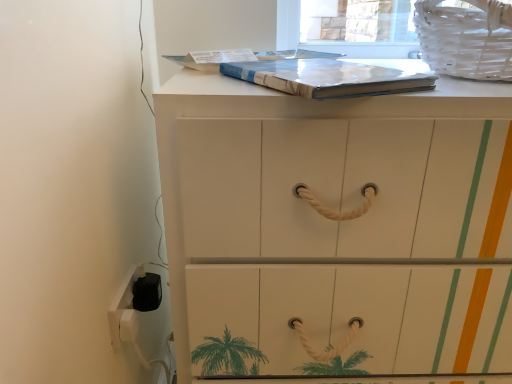
What do you see at coordinates (121, 305) in the screenshot? I see `white plastic electric outlet at lower left` at bounding box center [121, 305].

Where is `white wicker laundry basket at upper right`? This screenshot has height=384, width=512. white wicker laundry basket at upper right is located at coordinates (466, 38).

You are a GUI agent. You are given a task and a screenshot of the screen. Output one action in this format:
    pyautogui.click(x=<x>, y=<y>)
    Task: Click on the white plastic electric outlet at lower left
    Image resolution: width=512 pixels, height=384 pixels.
    Given the screenshot: What is the action you would take?
    pyautogui.click(x=121, y=305)

Can you confirm if matte blue paperback book at upper center is bigger than white plastic electric outlet at lower left?

Yes, matte blue paperback book at upper center is bigger than white plastic electric outlet at lower left.

Considering the relative positions of matte blue paperback book at upper center and white plastic electric outlet at lower left in the image provided, is matte blue paperback book at upper center to the left or to the right of white plastic electric outlet at lower left?

In the image, matte blue paperback book at upper center appears on the right side of white plastic electric outlet at lower left.

Is matte blue paperback book at upper center looking in the opposite direction of white plastic electric outlet at lower left?

matte blue paperback book at upper center is not turned away from white plastic electric outlet at lower left.

Identify the location of paperback book located above the white plastic electric outlet at lower left (from the image's perspective). The width and height of the screenshot is (512, 384). (327, 78).

Measure the distance from white painted wood chest of drawers at center to matte blue paperback book at upper center.

white painted wood chest of drawers at center is 8.57 inches away from matte blue paperback book at upper center.

Which object is positioned more to the left, white painted wood chest of drawers at center or matte blue paperback book at upper center?

From the viewer's perspective, matte blue paperback book at upper center appears more on the left side.

In the scene shown: Is white painted wood chest of drawers at center far away from matte blue paperback book at upper center?

No, white painted wood chest of drawers at center is in close proximity to matte blue paperback book at upper center.

The image size is (512, 384). Find the location of `paperback book above the white painted wood chest of drawers at center (from the image's perspective)`. paperback book above the white painted wood chest of drawers at center (from the image's perspective) is located at coordinates (327, 78).

Considering the relative positions of white plastic electric outlet at lower left and matte blue paperback book at upper center in the image provided, is white plastic electric outlet at lower left to the left or to the right of matte blue paperback book at upper center?

white plastic electric outlet at lower left is to the left of matte blue paperback book at upper center.

Looking at their sizes, would you say white plastic electric outlet at lower left is wider or thinner than matte blue paperback book at upper center?

In the image, white plastic electric outlet at lower left appears to be more narrow than matte blue paperback book at upper center.

From the image's perspective, is white plastic electric outlet at lower left located beneath matte blue paperback book at upper center?

Yes, from the image's perspective, white plastic electric outlet at lower left is below matte blue paperback book at upper center.

Is white painted wood chest of drawers at center next to white wicker laundry basket at upper right?

No, white painted wood chest of drawers at center is not next to white wicker laundry basket at upper right.

Where is `laundry basket lying above the white painted wood chest of drawers at center (from the image's perspective)`? The width and height of the screenshot is (512, 384). laundry basket lying above the white painted wood chest of drawers at center (from the image's perspective) is located at coordinates (466, 38).

How different are the orientations of white painted wood chest of drawers at center and white wicker laundry basket at upper right in degrees?

The angle between the facing direction of white painted wood chest of drawers at center and the facing direction of white wicker laundry basket at upper right is 0.000386 degrees.

Is white wicker laundry basket at upper right aimed at matte blue paperback book at upper center?

No, white wicker laundry basket at upper right is not turned towards matte blue paperback book at upper center.

Considering the relative sizes of white wicker laundry basket at upper right and matte blue paperback book at upper center in the image provided, is white wicker laundry basket at upper right bigger than matte blue paperback book at upper center?

Yes.

Considering the points (468, 23) and (342, 77), which point is in front, point (468, 23) or point (342, 77)?

Point (342, 77)

From a real-world perspective, which object rests below the other?

matte blue paperback book at upper center, from a real-world perspective.

Is white wicker laundry basket at upper right in contact with white painted wood chest of drawers at center?

There is a gap between white wicker laundry basket at upper right and white painted wood chest of drawers at center.

Is white wicker laundry basket at upper right to the right of white painted wood chest of drawers at center from the viewer's perspective?

Yes, white wicker laundry basket at upper right is to the right of white painted wood chest of drawers at center.

Choose the correct answer: Is white wicker laundry basket at upper right inside white painted wood chest of drawers at center or outside it?

white wicker laundry basket at upper right is not enclosed by white painted wood chest of drawers at center.

Which of these two, white wicker laundry basket at upper right or white painted wood chest of drawers at center, is smaller?

white wicker laundry basket at upper right is smaller.

Is matte blue paperback book at upper center taller or shorter than white wicker laundry basket at upper right?

Clearly, matte blue paperback book at upper center is shorter compared to white wicker laundry basket at upper right.

Considering the relative sizes of matte blue paperback book at upper center and white wicker laundry basket at upper right in the image provided, is matte blue paperback book at upper center thinner than white wicker laundry basket at upper right?

Yes, matte blue paperback book at upper center is thinner than white wicker laundry basket at upper right.

Which is more to the left, matte blue paperback book at upper center or white wicker laundry basket at upper right?

matte blue paperback book at upper center is more to the left.

Would you consider matte blue paperback book at upper center to be distant from white wicker laundry basket at upper right?

matte blue paperback book at upper center is actually quite close to white wicker laundry basket at upper right.

Where is `electric outlet lying behind the matte blue paperback book at upper center`? electric outlet lying behind the matte blue paperback book at upper center is located at coordinates (121, 305).

Identify the location of the chest of drawers directly beneath the matte blue paperback book at upper center (from a real-world perspective). Image resolution: width=512 pixels, height=384 pixels. (339, 225).

Considering their positions, is white plastic electric outlet at lower left positioned further to white wicker laundry basket at upper right than matte blue paperback book at upper center?

The object further to white wicker laundry basket at upper right is white plastic electric outlet at lower left.

From the image, which object appears to be farther from white wicker laundry basket at upper right, white painted wood chest of drawers at center or white plastic electric outlet at lower left?

Based on the image, white plastic electric outlet at lower left appears to be further to white wicker laundry basket at upper right.

Based on their spatial positions, is white wicker laundry basket at upper right or white painted wood chest of drawers at center further from matte blue paperback book at upper center?

white painted wood chest of drawers at center lies further to matte blue paperback book at upper center than the other object.

From the image, which object appears to be nearer to white plastic electric outlet at lower left, white painted wood chest of drawers at center or white wicker laundry basket at upper right?

Based on the image, white painted wood chest of drawers at center appears to be nearer to white plastic electric outlet at lower left.

When comparing their distances from matte blue paperback book at upper center, does white plastic electric outlet at lower left or white painted wood chest of drawers at center seem closer?

white painted wood chest of drawers at center is positioned closer to the anchor matte blue paperback book at upper center.

Looking at the image, which one is located further to white painted wood chest of drawers at center, matte blue paperback book at upper center or white wicker laundry basket at upper right?

white wicker laundry basket at upper right lies further to white painted wood chest of drawers at center than the other object.

Which object lies further to the anchor point white plastic electric outlet at lower left, white wicker laundry basket at upper right or white painted wood chest of drawers at center?

The object further to white plastic electric outlet at lower left is white wicker laundry basket at upper right.

Looking at the image, which one is located further to matte blue paperback book at upper center, white painted wood chest of drawers at center or white wicker laundry basket at upper right?

The object further to matte blue paperback book at upper center is white painted wood chest of drawers at center.

Where is `chest of drawers between white plastic electric outlet at lower left and white wicker laundry basket at upper right from left to right`? chest of drawers between white plastic electric outlet at lower left and white wicker laundry basket at upper right from left to right is located at coordinates (339, 225).

At what (x,y) coordinates should I click in order to perform the action: click on paperback book between white plastic electric outlet at lower left and white painted wood chest of drawers at center in the horizontal direction. Please return your answer as a coordinate pair (x, y). The image size is (512, 384). Looking at the image, I should click on (327, 78).

Identify the location of paperback book between white plastic electric outlet at lower left and white wicker laundry basket at upper right in the horizontal direction. (327, 78).

Find the location of a particular element. The width and height of the screenshot is (512, 384). paperback book between white wicker laundry basket at upper right and white painted wood chest of drawers at center in the vertical direction is located at coordinates (327, 78).